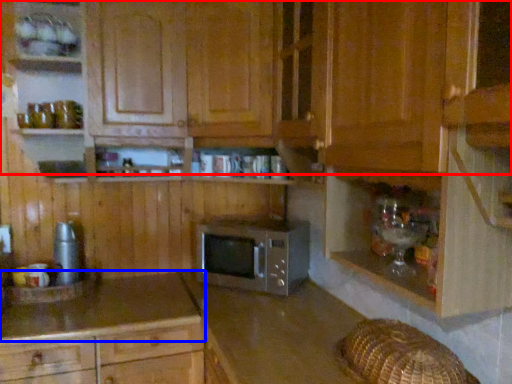
Question: Which object is closer to the camera taking this photo, cabinetry (highlighted by a red box) or countertop (highlighted by a blue box)?

Choices:
 (A) cabinetry
 (B) countertop

Answer: (A)